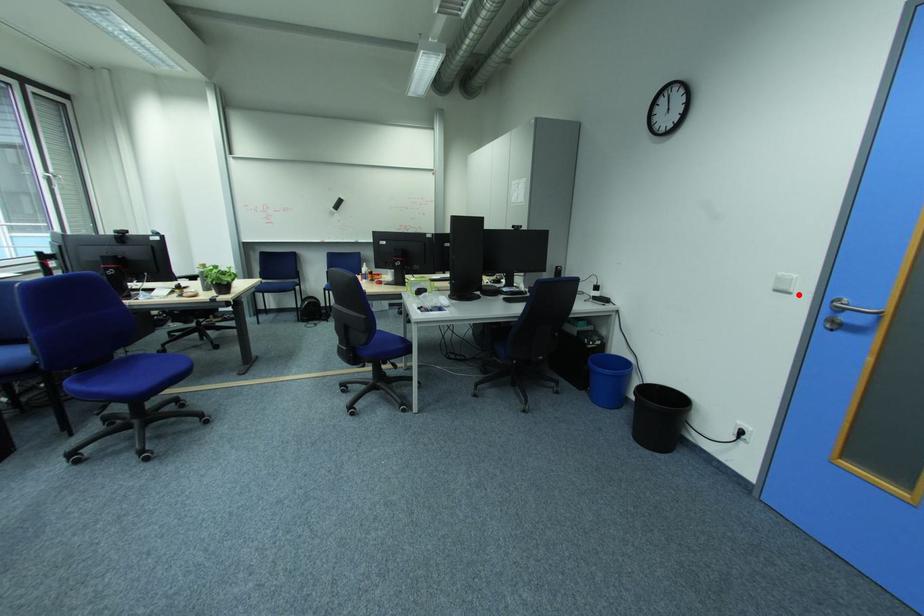
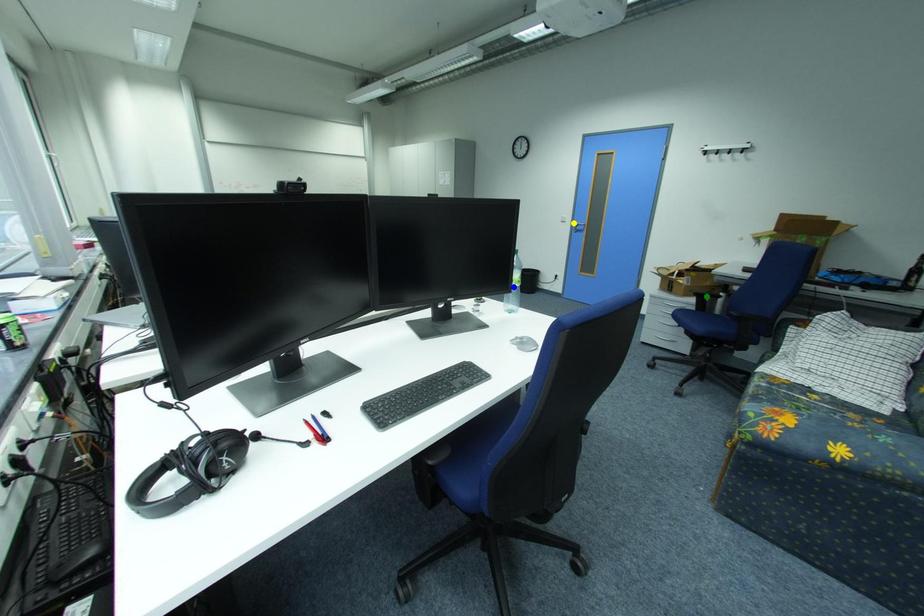
Question: I am providing you with two images of the same scene from different viewpoints. A red point is marked on the first image. You are given multiple points on the second image. In image 2, which mark is for the same physical point as the one in image 1?

Choices:
 (A) yellow point
 (B) blue point
 (C) green point

Answer: (A)